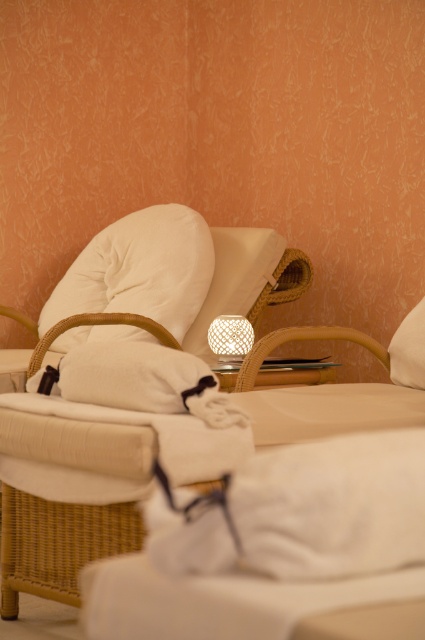
You are standing in the spa room and want to place a small plant between the woven wood armchair at left and the woven bamboo lamp at center. Which object should you place the plant closer to if you want it to be closer to the wall?

You should place the plant closer to the woven bamboo lamp at center because the woven wood armchair at left is closer to the viewer, meaning the woven bamboo lamp at center is nearer to the wall.

You are standing in the spa room and want to place a small potted plant exactly at the point marked as point (x=127, y=397). Is there enough space there to place the plant without it being too close to the woven wood armchair at left?

The woven wood armchair at left is located at point (x=127, y=397), so placing the plant there would mean it is directly on top of the armchair, which is not feasible. Choose a different location.